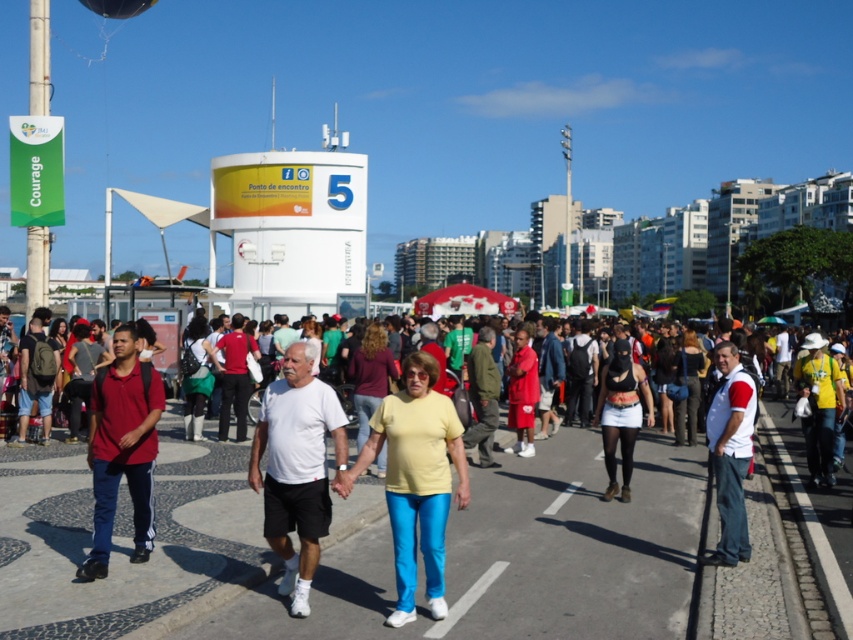
You are a photographer at the event and want to take a photo of both the yellow matte shirt at center and the white matte shirt at center. Which shirt should you focus on first to ensure both are in clear view?

The yellow matte shirt at center is closer to the viewer than the white matte shirt at center. To ensure both are in clear view, focus on the white matte shirt at center first since it is further away, allowing the depth of field to cover the closer subject as well.

You are standing at the meeting point structure and want to take a photo of both point (527, 394) and point (115, 3) in the scene. Which point should you focus on first to ensure both are in focus?

You should focus on point (527, 394) first because it is closer to the camera than point (115, 3), ensuring both will be in focus when using depth of field.

You are a photographer standing at the center of the paved area. You want to take a photo that includes both the red fabric shirt at center and the transparent plastic balloon at upper left. Given that your camera has a maximum zoom range of 20 meters, will you be able to capture both objects in a single frame without moving?

The red fabric shirt at center and transparent plastic balloon at upper left are 26.08 meters apart from each other. Since your camera can only zoom up to 20 meters, you won